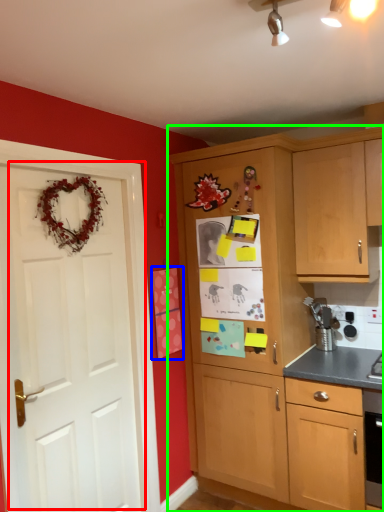
Question: Which object is positioned closest to door (highlighted by a red box)? Select from postcard (highlighted by a blue box) and cabinetry (highlighted by a green box).

Choices:
 (A) postcard
 (B) cabinetry

Answer: (A)